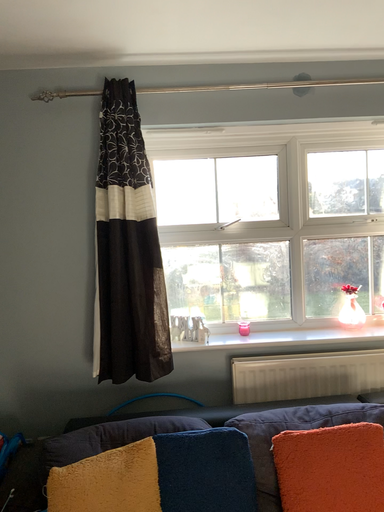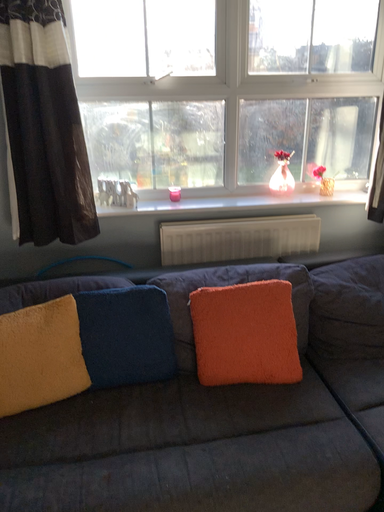
Question: Which way did the camera rotate in the video?

Choices:
 (A) rotated upward
 (B) rotated downward

Answer: (B)